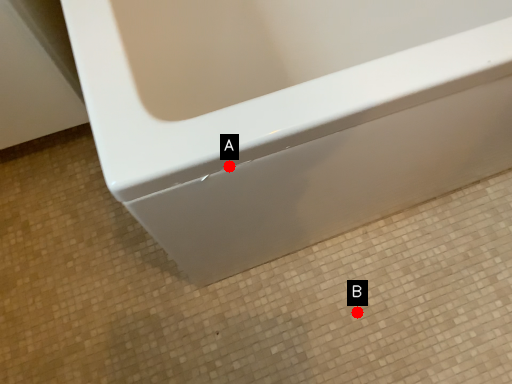
Question: Two points are circled on the image, labeled by A and B beside each circle. Which point is closer to the camera?

Choices:
 (A) A is closer
 (B) B is closer

Answer: (A)